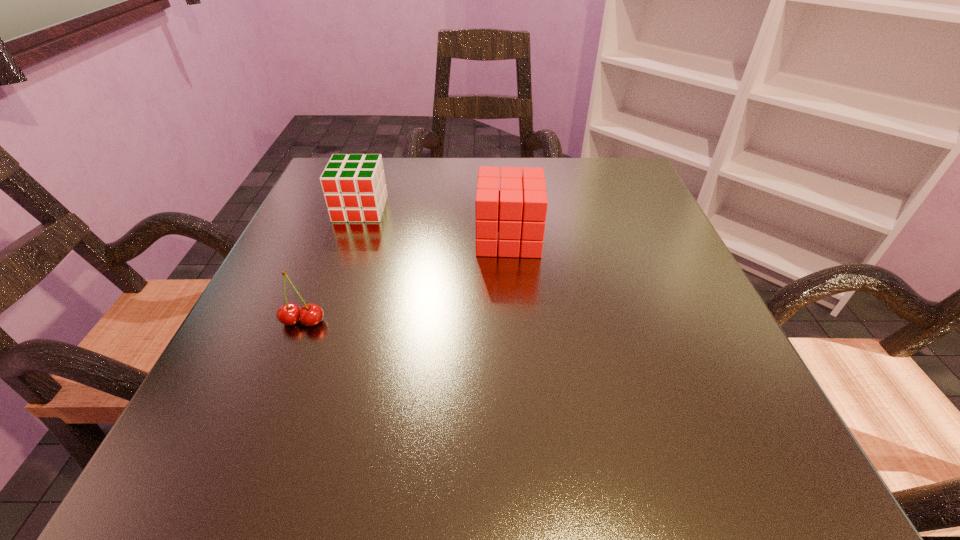
You are a GUI agent. You are given a task and a screenshot of the screen. Output one action in this format:
    pyautogui.click(x=<x>, y=<y>)
    Task: Click on the object present at the far left corner
    
    Given the screenshot: What is the action you would take?
    pyautogui.click(x=354, y=188)

Locate an element on the screen. The image size is (960, 540). vacant space at the far edge of the desktop is located at coordinates (459, 203).

You are a GUI agent. You are given a task and a screenshot of the screen. Output one action in this format:
    pyautogui.click(x=<x>, y=<y>)
    Task: Click on the free space at the near edge of the desktop
    
    Given the screenshot: What is the action you would take?
    pyautogui.click(x=336, y=421)

In the image, there is a desktop. Identify the location of free space at the left edge. This screenshot has height=540, width=960. (311, 256).

The width and height of the screenshot is (960, 540). I want to click on vacant space at the right edge of the desktop, so click(x=700, y=290).

Find the location of a particular element. free region at the near left corner of the desktop is located at coordinates (196, 449).

You are a GUI agent. You are given a task and a screenshot of the screen. Output one action in this format:
    pyautogui.click(x=<x>, y=<y>)
    Task: Click on the free space at the far right corner
    The height and width of the screenshot is (540, 960).
    Given the screenshot: What is the action you would take?
    coord(612,192)

You are a GUI agent. You are given a task and a screenshot of the screen. Output one action in this format:
    pyautogui.click(x=<x>, y=<y>)
    Task: Click on the vacant region between the right cube and the left cube
    
    Given the screenshot: What is the action you would take?
    pyautogui.click(x=435, y=224)

You are a GUI agent. You are given a task and a screenshot of the screen. Output one action in this format:
    pyautogui.click(x=<x>, y=<y>)
    Task: Click on the vacant space that's between the taller cube and the cherry
    This screenshot has width=960, height=540.
    Given the screenshot: What is the action you would take?
    pyautogui.click(x=406, y=280)

At what (x,y) coordinates should I click in order to perform the action: click on free space between the nearest object and the shorter cube. Please return your answer as a coordinate pair (x, y). This screenshot has height=540, width=960. Looking at the image, I should click on (332, 265).